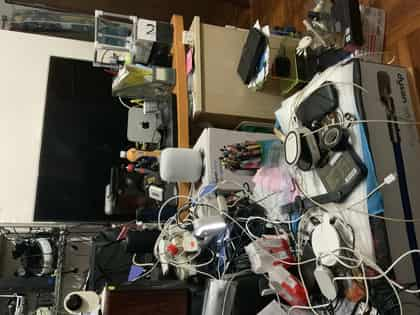
Identify the location of metal shelving unit. (62, 239).